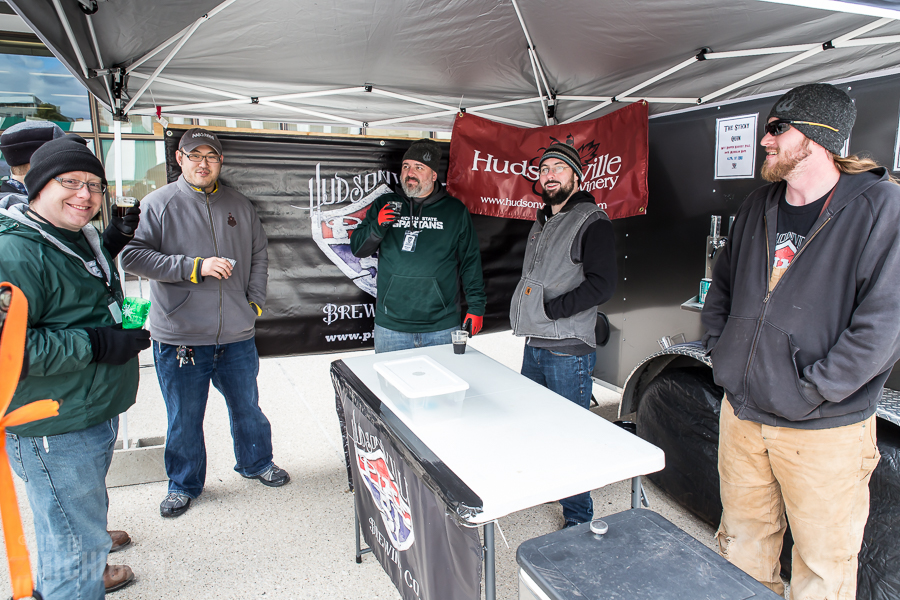
Identify the location of floor. [x=257, y=561].